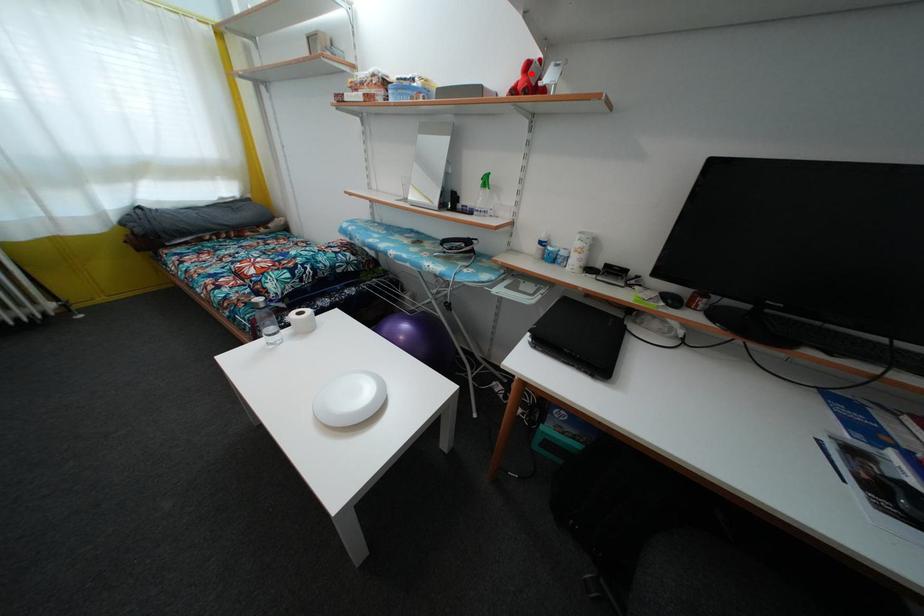
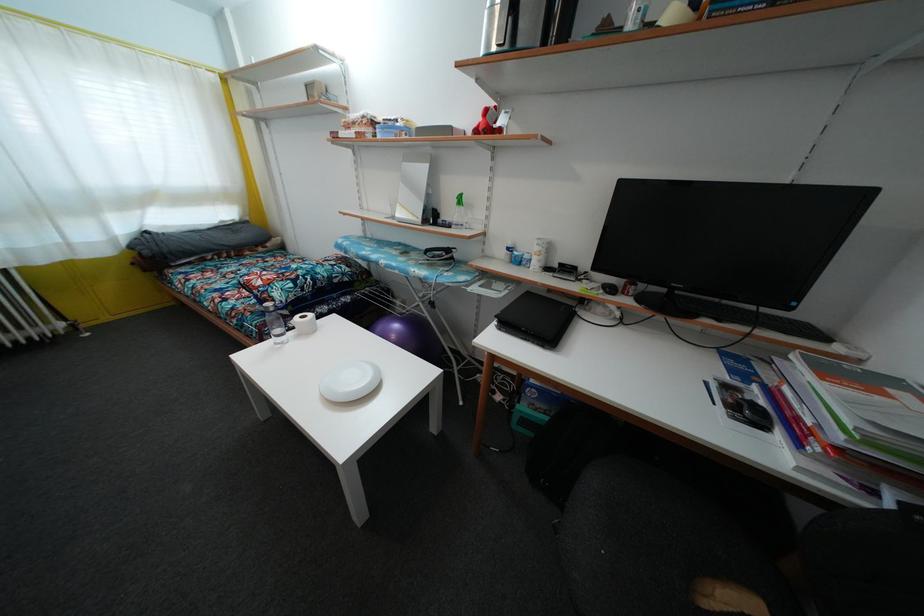
Locate, in the second image, the point that corresponds to the highlighted location in the first image.

(490, 119)